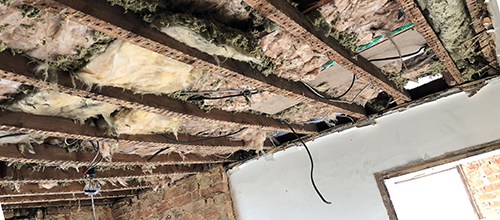
Where is `ceiling beams`? The image size is (500, 220). ceiling beams is located at coordinates (286, 20), (225, 65), (162, 107), (75, 130).